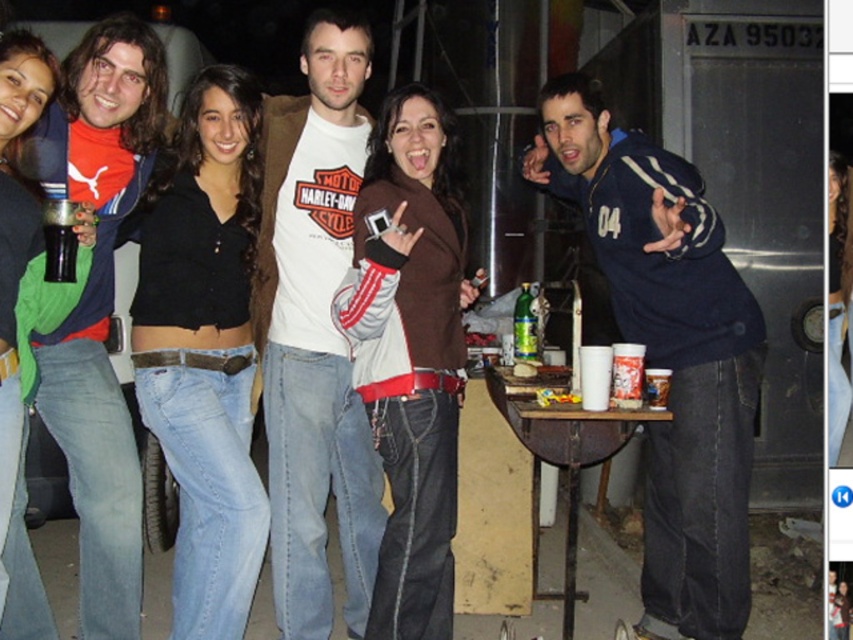
Looking at this image, you are standing in front of the group and see the matte blue jacket at left and the black plastic cup at left. Which one is closer to you?

The matte blue jacket at left is closer to you because it is further to the viewer than the black plastic cup at left.

You are standing at the center of the group and want to take a photo of both point (689, 484) and point (196, 88). Will you be able to capture both points in the same photo without moving your camera?

Yes, because point (689, 484) is in front of point (196, 88), so both can be captured in the same photo without moving the camera.